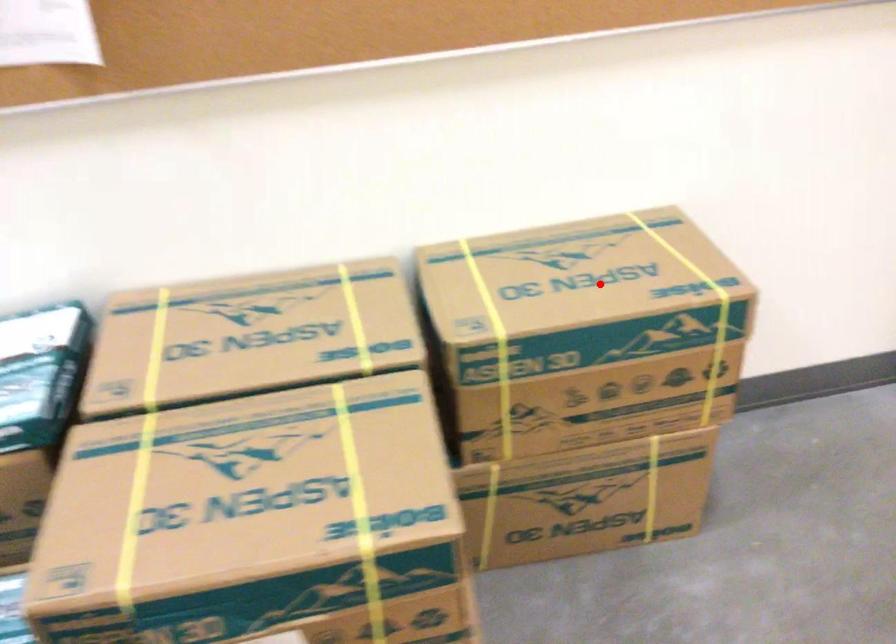
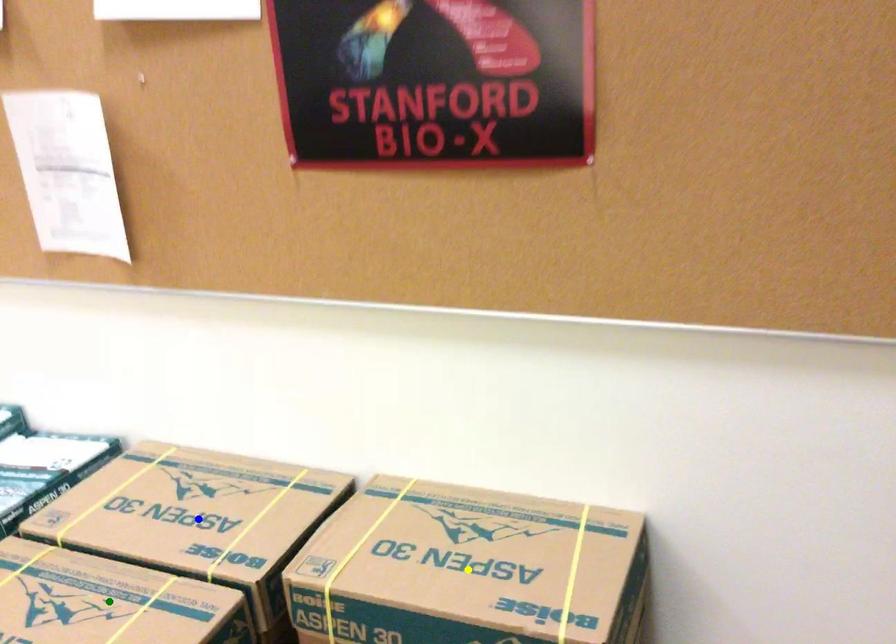
Question: I am providing you with two images of the same scene from different viewpoints. A red point is marked on the first image. You are given multiple points on the second image. Which spot in image 2 lines up with the point in image 1?

Choices:
 (A) blue point
 (B) green point
 (C) yellow point

Answer: (C)